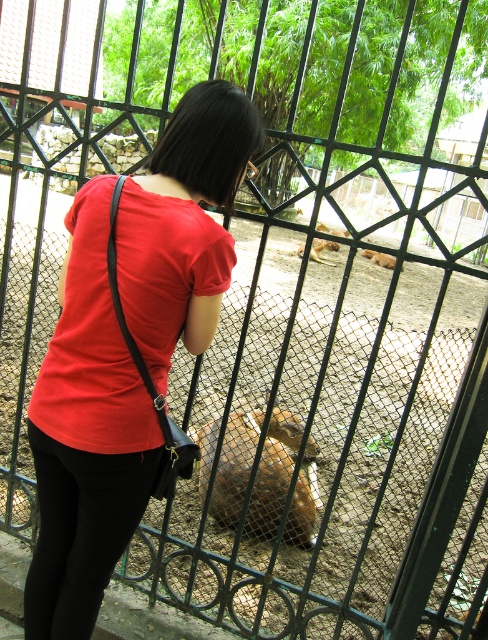
Which is behind, point (136, 490) or point (309, 253)?

The point (309, 253) is more distant.

Which is in front, point (128, 470) or point (334, 262)?

Point (128, 470) is more forward.

The width and height of the screenshot is (488, 640). I want to click on matte red shirt at center, so click(x=85, y=436).

How much distance is there between brown furry animal at center and brown furry deer at center?

A distance of 26.90 feet exists between brown furry animal at center and brown furry deer at center.

Which is in front, point (257, 522) or point (314, 257)?

Point (257, 522) is in front.

Where is `brown furry animal at center`? brown furry animal at center is located at coordinates (272, 474).

Who is taller, matte red shirt at center or brown furry dog at center?

With more height is matte red shirt at center.

Which is in front, point (66, 452) or point (392, 268)?

Positioned in front is point (66, 452).

What do you see at coordinates (85, 436) in the screenshot? The height and width of the screenshot is (640, 488). I see `matte red shirt at center` at bounding box center [85, 436].

The image size is (488, 640). I want to click on matte red shirt at center, so [85, 436].